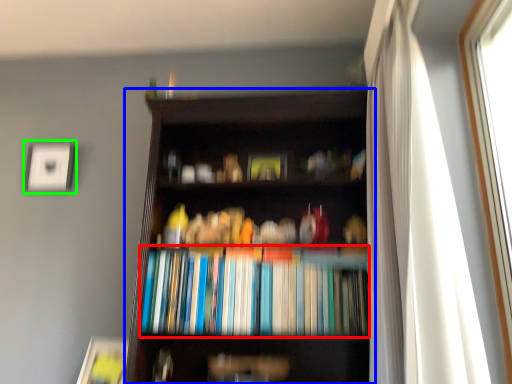
Question: Which object is positioned farthest from book (highlighted by a red box)? Select from bookcase (highlighted by a blue box) and picture frame (highlighted by a green box).

Choices:
 (A) bookcase
 (B) picture frame

Answer: (B)